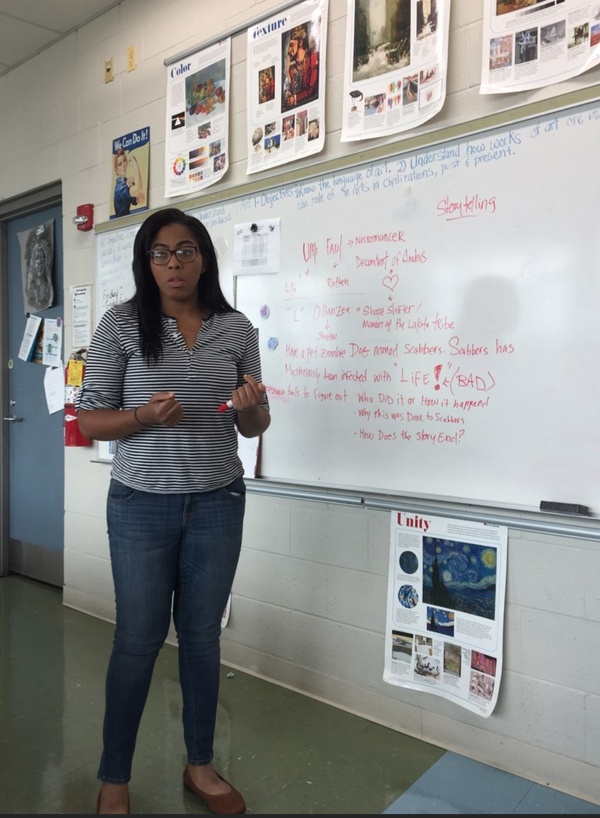
You are a GUI agent. You are given a task and a screenshot of the screen. Output one action in this format:
    pyautogui.click(x=<x>, y=<y>)
    Task: Click on the dry erase marker
    This screenshot has width=600, height=818.
    Given the screenshot: What is the action you would take?
    pyautogui.click(x=226, y=406)